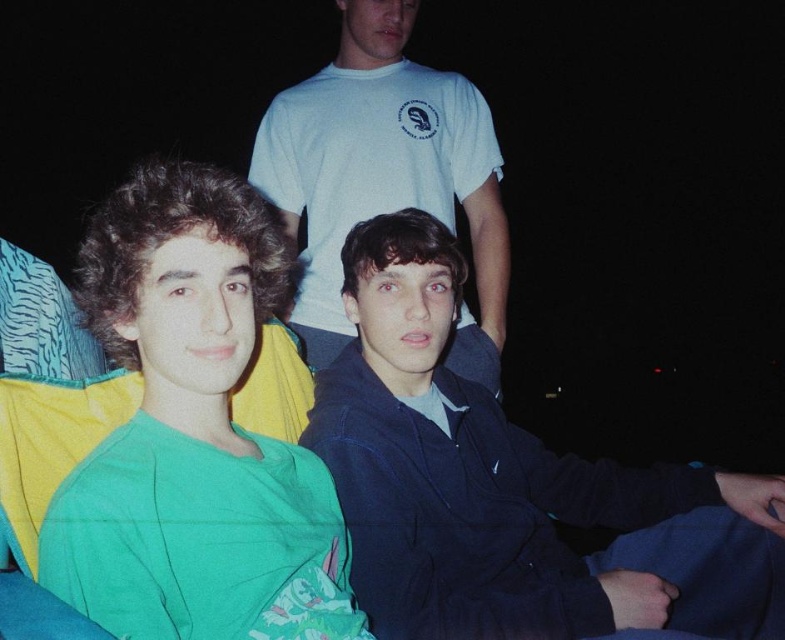
You are trying to locate the dark blue jacket at center in this nighttime scene. Based on the coordinates provided, can you confirm if the point at (510,486) aligns with the position of the dark blue jacket at center?

Yes, the point at (510,486) corresponds to the dark blue jacket at center as per the description.